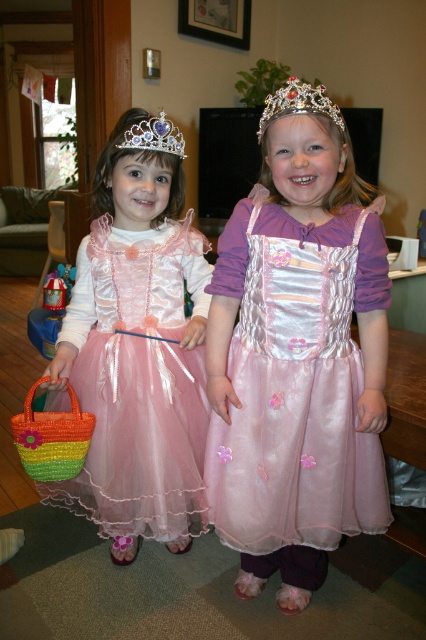
What is located at the coordinates point (294, 387) in the image?

The pink satin dress at center is located at point (294, 387).